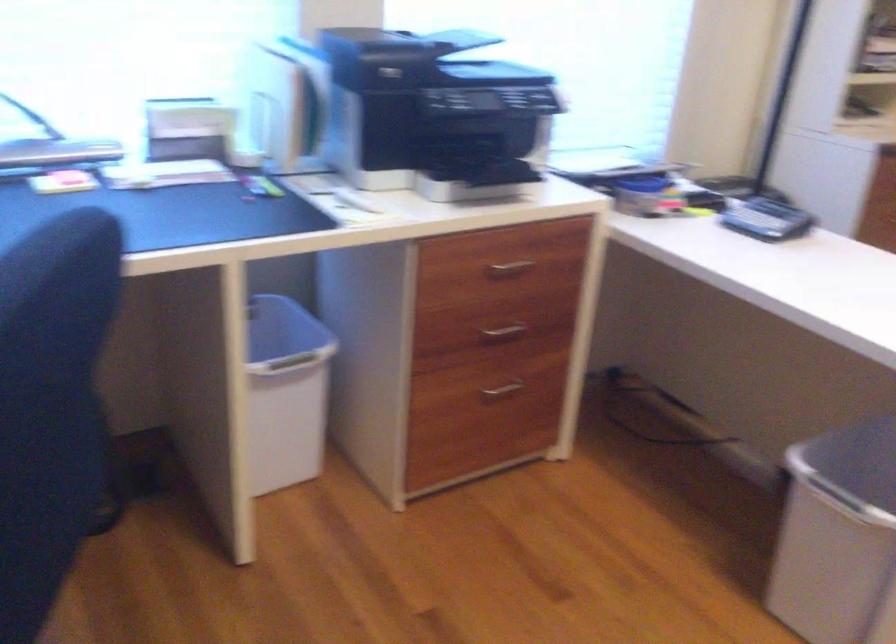
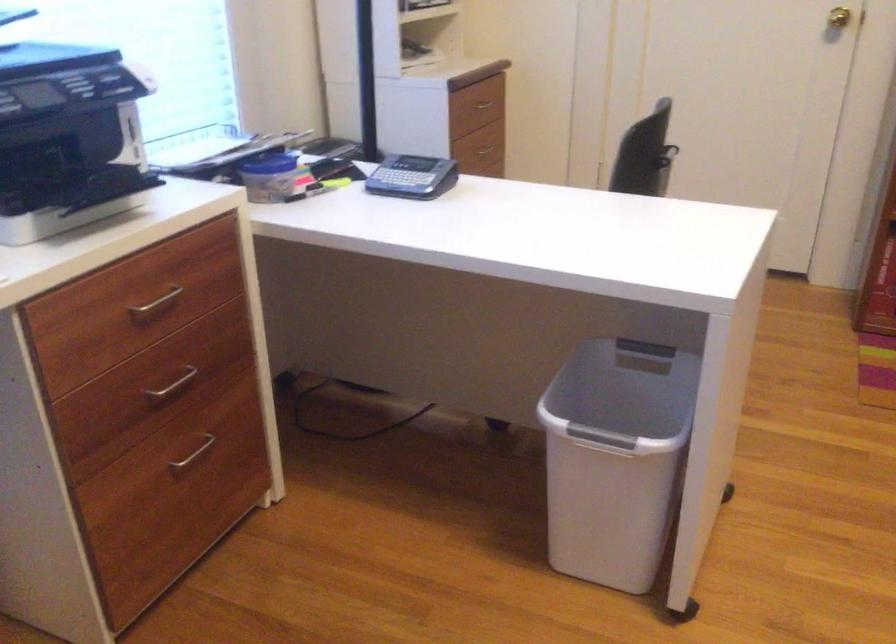
Question: The first image is from the beginning of the video and the second image is from the end. How did the camera likely rotate when shooting the video?

Choices:
 (A) Left
 (B) Right
 (C) Up
 (D) Down

Answer: (B)